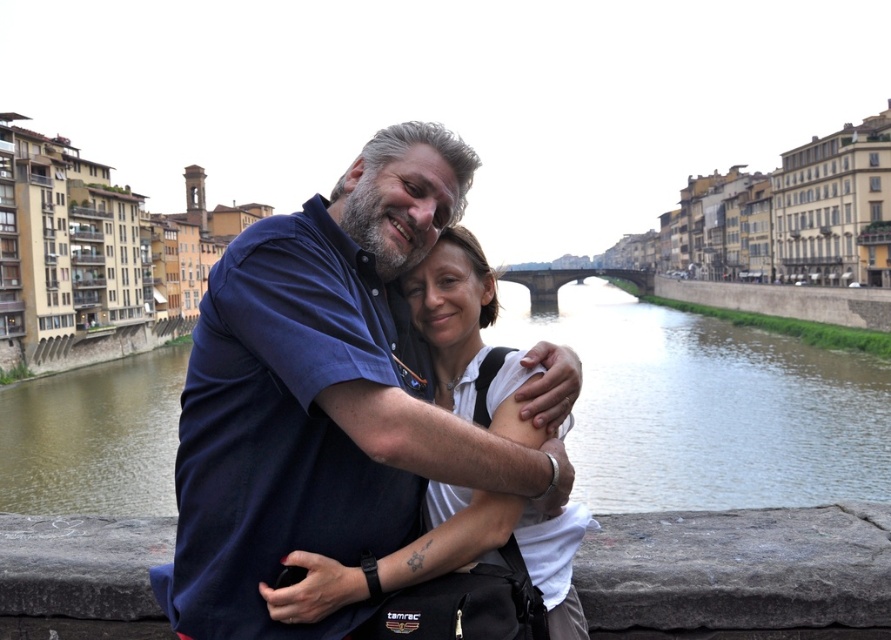
You are a photographer standing at the riverbank. You want to take a photo of the blue cotton shirt at center and the brown water at center so that both are fully visible. Which object should you focus on first to ensure they both fit in the frame?

The blue cotton shirt at center is not as tall as brown water at center, so you should focus on the taller brown water at center first to ensure both fit in the frame.

You are standing at the riverbank and want to throw a pebble into the brown water at center. Considering the distance, will the pebble reach the water?

The brown water at center is 88.81 meters away from you. Since the average human can throw a pebble about 20 meters, you won not be able to reach the water with your throw.